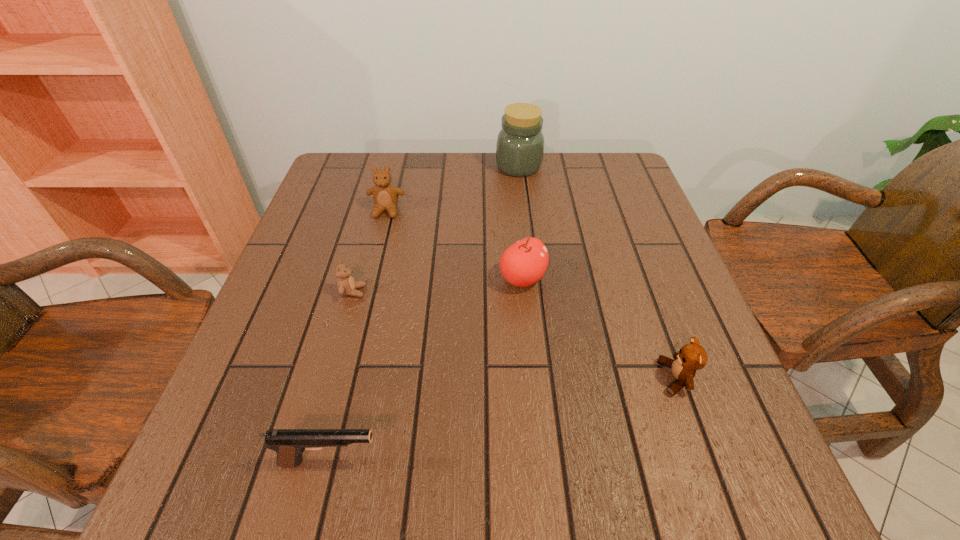
Where is `the tallest object`? the tallest object is located at coordinates (520, 143).

Locate an element on the screen. jar is located at coordinates (520, 143).

You are a GUI agent. You are given a task and a screenshot of the screen. Output one action in this format:
    pyautogui.click(x=<x>, y=<y>)
    Task: Click on the farthest teddy bear
    This screenshot has height=540, width=960.
    Given the screenshot: What is the action you would take?
    pyautogui.click(x=385, y=195)

Locate an element on the screen. The image size is (960, 540). the tallest teddy bear is located at coordinates (385, 195).

You are a GUI agent. You are given a task and a screenshot of the screen. Output one action in this format:
    pyautogui.click(x=<x>, y=<y>)
    Task: Click on the apple
    The height and width of the screenshot is (540, 960).
    Given the screenshot: What is the action you would take?
    pyautogui.click(x=524, y=263)

What are the coordinates of `the nearest object` in the screenshot? It's located at (289, 444).

Identify the location of the rightmost object. (691, 357).

This screenshot has width=960, height=540. I want to click on the rightmost teddy bear, so click(691, 357).

Locate an element on the screen. the second nearest teddy bear is located at coordinates (346, 285).

Locate an element on the screen. The width and height of the screenshot is (960, 540). free space located on the front of the jar is located at coordinates (532, 277).